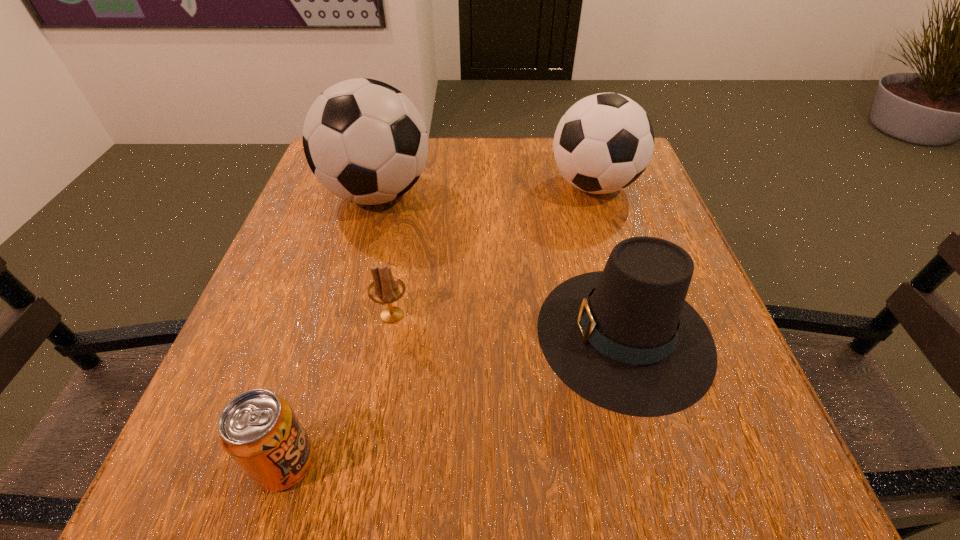
Find the location of a particular element. The width and height of the screenshot is (960, 540). the left soccer ball is located at coordinates (365, 141).

Identify the location of the taller soccer ball. (365, 141).

At what (x,y) coordinates should I click in order to perform the action: click on the shorter soccer ball. Please return your answer as a coordinate pair (x, y). Looking at the image, I should click on (604, 142).

At what (x,y) coordinates should I click in order to perform the action: click on the right soccer ball. Please return your answer as a coordinate pair (x, y). Looking at the image, I should click on (604, 142).

Find the location of a particular element. the third tallest object is located at coordinates (625, 339).

Identify the location of candle holder. This screenshot has width=960, height=540. (385, 289).

I want to click on soda can, so click(258, 429).

Locate an element on the screen. vacant space located on the front of the left soccer ball is located at coordinates (320, 402).

Locate an element on the screen. free space located on the left of the fourth shortest object is located at coordinates (515, 186).

Where is `vacant region located on the front-facing side of the third tallest object`? The image size is (960, 540). vacant region located on the front-facing side of the third tallest object is located at coordinates (478, 334).